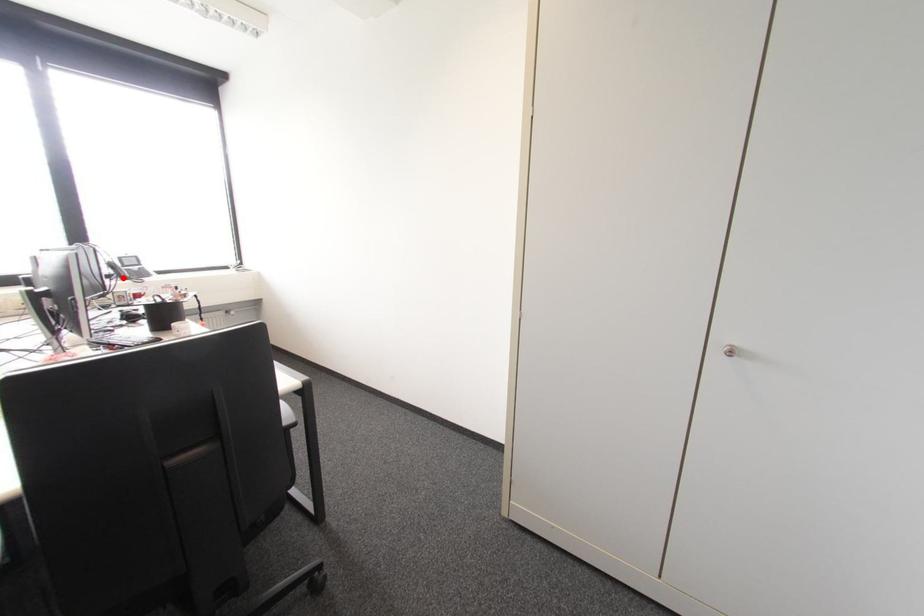
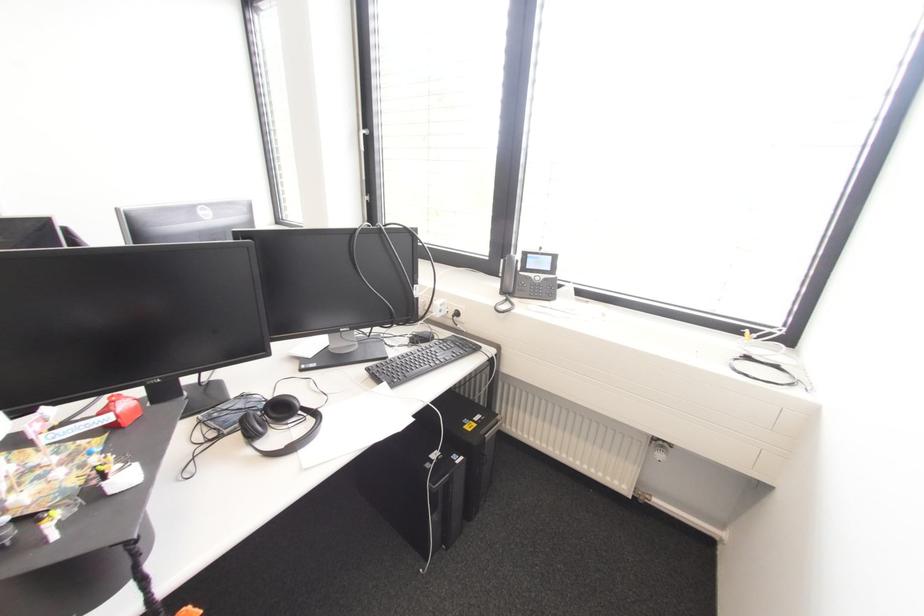
Question: I am providing you with two images of the same scene from different viewpoints. A red point is marked on the first image. At the location where the point appears in image 1, is it still visible in image 2?

Choices:
 (A) Yes
 (B) No

Answer: (A)